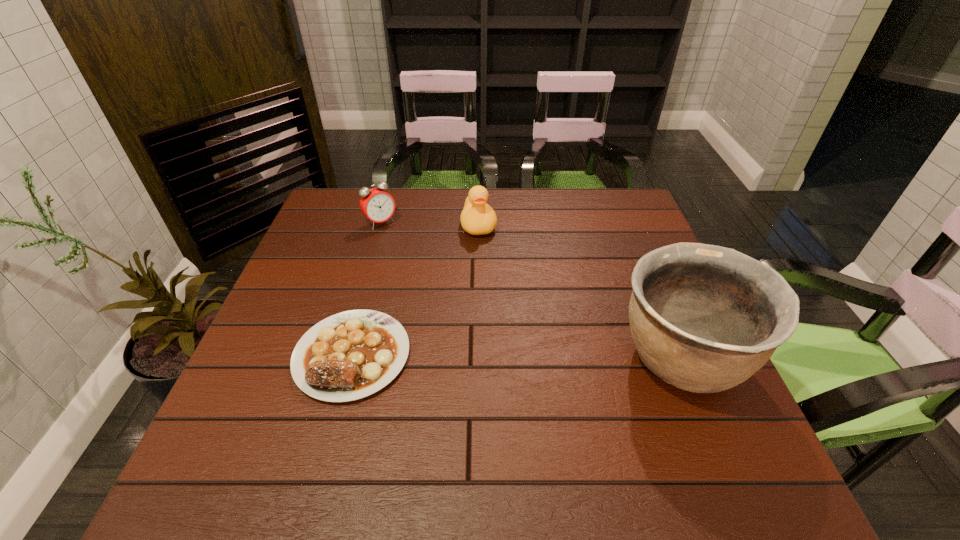
At what (x,y) coordinates should I click in order to perform the action: click on vacant area situated 0.070m on the front-facing side of the alarm clock. Please return your answer as a coordinate pair (x, y). Looking at the image, I should click on (399, 241).

The height and width of the screenshot is (540, 960). Identify the location of vacant space located on the front-facing side of the alarm clock. (425, 269).

At what (x,y) coordinates should I click in order to perform the action: click on free point located on the front-facing side of the alarm clock. Please return your answer as a coordinate pair (x, y). Looking at the image, I should click on (441, 286).

Where is `duck positioned at the far edge`? duck positioned at the far edge is located at coordinates (477, 218).

Find the location of a particular element. The image size is (960, 540). alarm clock that is at the far edge is located at coordinates (376, 204).

You are a GUI agent. You are given a task and a screenshot of the screen. Output one action in this format:
    pyautogui.click(x=<x>, y=<y>)
    Task: Click on the steak positioned at the near edge
    
    Given the screenshot: What is the action you would take?
    pyautogui.click(x=350, y=355)

Where is `pottery present at the near edge`? Image resolution: width=960 pixels, height=540 pixels. pottery present at the near edge is located at coordinates (704, 318).

Where is `steak that is at the left edge`? steak that is at the left edge is located at coordinates (350, 355).

Find the location of `alarm clock situated at the left edge`. alarm clock situated at the left edge is located at coordinates (376, 204).

The height and width of the screenshot is (540, 960). I want to click on object at the right edge, so click(704, 318).